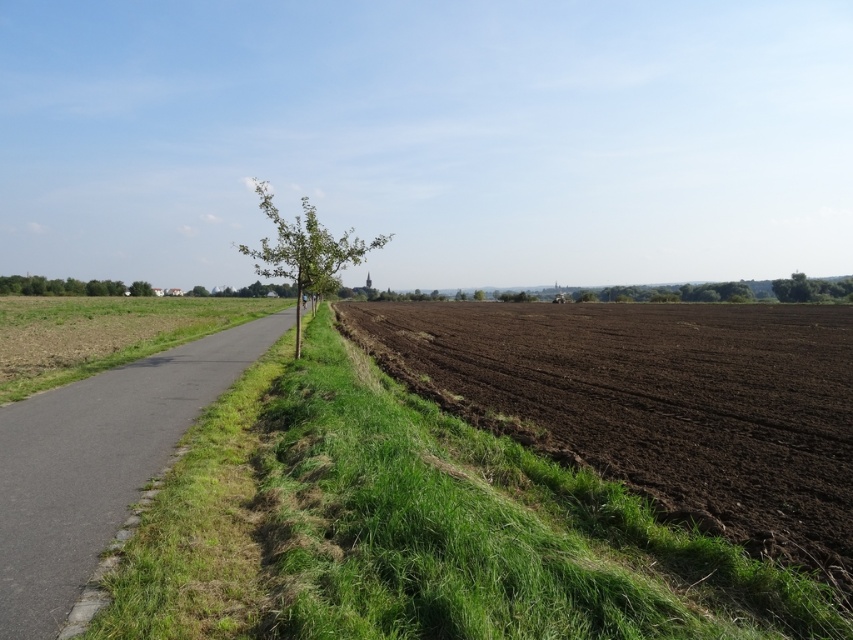
Consider the image. You are a gardener who needs to mow the green grass at lower left and water the green leafy tree at left. Which task should you do first if you want to tackle the shorter vegetation first?

The green grass at lower left is not as tall as the green leafy tree at left, so you should mow the green grass at lower left first since it is shorter.

You are a hiker standing at the bottom left corner of the image, looking towards the center. You notice two green leafy trees in your view. Which tree, the green leafy tree at center or the green leafy tree at left, is closer to you?

The green leafy tree at left is closer to you because it is positioned to the left of the road near the bottom, whereas the green leafy tree at center is further along the road towards the center of the frame.

You are standing at the point marked as point (416, 531) in the image. Looking around, you see a paved road running diagonally from the bottom left corner towards the center. To your right, there is a large freshly plowed field with dark brown soil. What direction should you walk to reach the green grass at lower left?

Since you are standing at point (416, 531) which corresponds to green grass at lower left, you are already on the green grass at lower left. Therefore, you don not need to walk anywhere else.